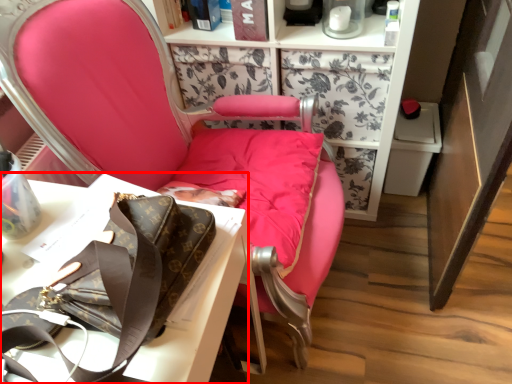
Question: From the image's perspective, where is desk (annotated by the red box) located relative to chair?

Choices:
 (A) above
 (B) below

Answer: (B)